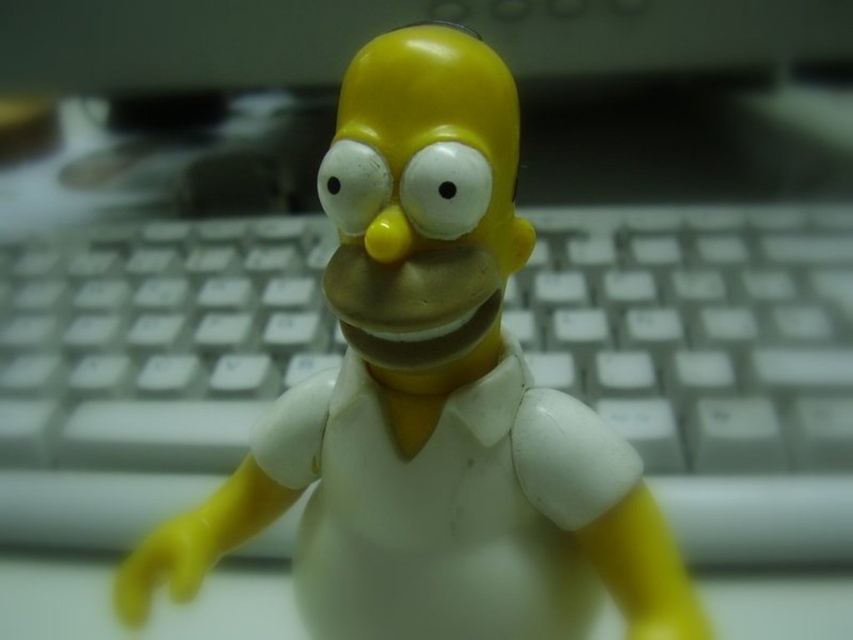
Question: Can you confirm if white plastic keyboard at center is thinner than yellow matte figure at center?

Choices:
 (A) no
 (B) yes

Answer: (A)

Question: Which object appears closest to the camera in this image?

Choices:
 (A) white plastic keyboard at center
 (B) yellow matte figure at center

Answer: (B)

Question: Observing the image, what is the correct spatial positioning of white plastic keyboard at center in reference to yellow matte figure at center?

Choices:
 (A) left
 (B) right

Answer: (A)

Question: Which point is farther to the camera?

Choices:
 (A) (352, 422)
 (B) (20, 296)

Answer: (B)

Question: Is white plastic keyboard at center smaller than yellow matte figure at center?

Choices:
 (A) no
 (B) yes

Answer: (A)